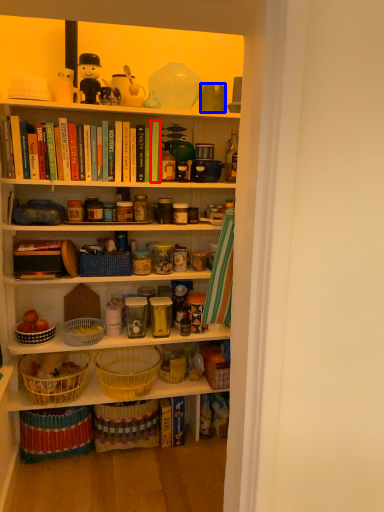
Question: Which of the following is the farthest to the observer, book (highlighted by a red box) or coffee cup (highlighted by a blue box)?

Choices:
 (A) book
 (B) coffee cup

Answer: (A)